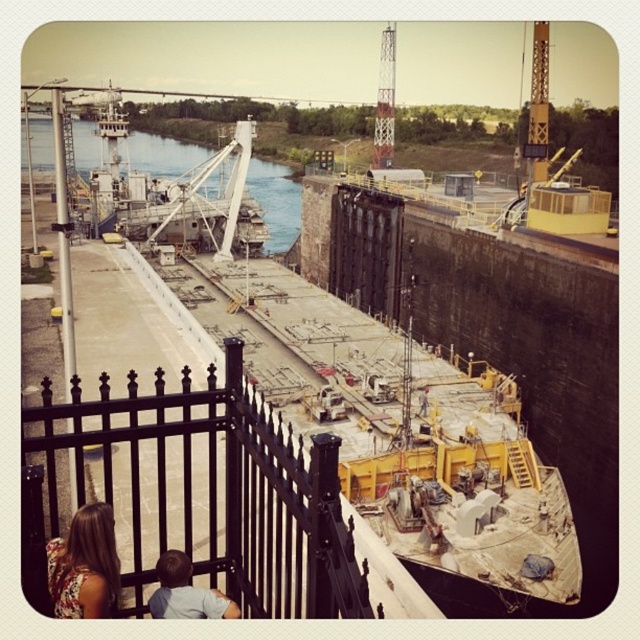
Question: Does smooth concrete waterway at upper left come behind light brown hair at lower left?

Choices:
 (A) no
 (B) yes

Answer: (B)

Question: Does black wrought iron fence at lower left lie behind light brown hair at lower left?

Choices:
 (A) yes
 (B) no

Answer: (B)

Question: Which of the following is the farthest from the observer?

Choices:
 (A) smooth concrete waterway at upper left
 (B) black wrought iron fence at lower left

Answer: (A)

Question: Estimate the real-world distances between objects in this image. Which object is farther from the smooth concrete waterway at upper left?

Choices:
 (A) light brown hair at lower left
 (B) black wrought iron fence at lower left

Answer: (A)

Question: Does black wrought iron fence at lower left come in front of smooth concrete waterway at upper left?

Choices:
 (A) yes
 (B) no

Answer: (A)

Question: Which object is closer to the camera taking this photo?

Choices:
 (A) black wrought iron fence at lower left
 (B) floral fabric dress at lower left
 (C) light brown hair at lower left

Answer: (A)